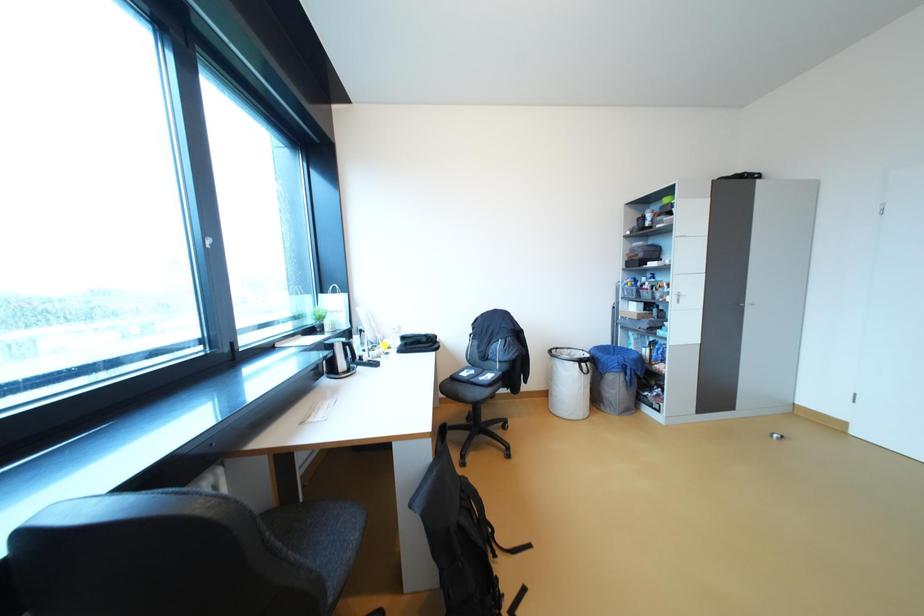
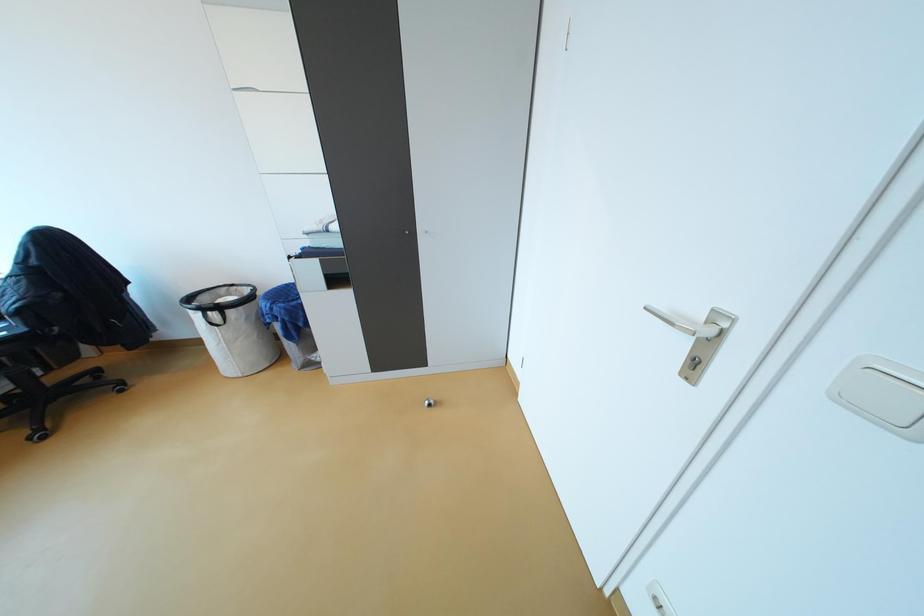
Question: In a continuous first-person perspective shot, in which direction is the camera moving?

Choices:
 (A) Left
 (B) Right
 (C) Forward
 (D) Backward

Answer: (B)